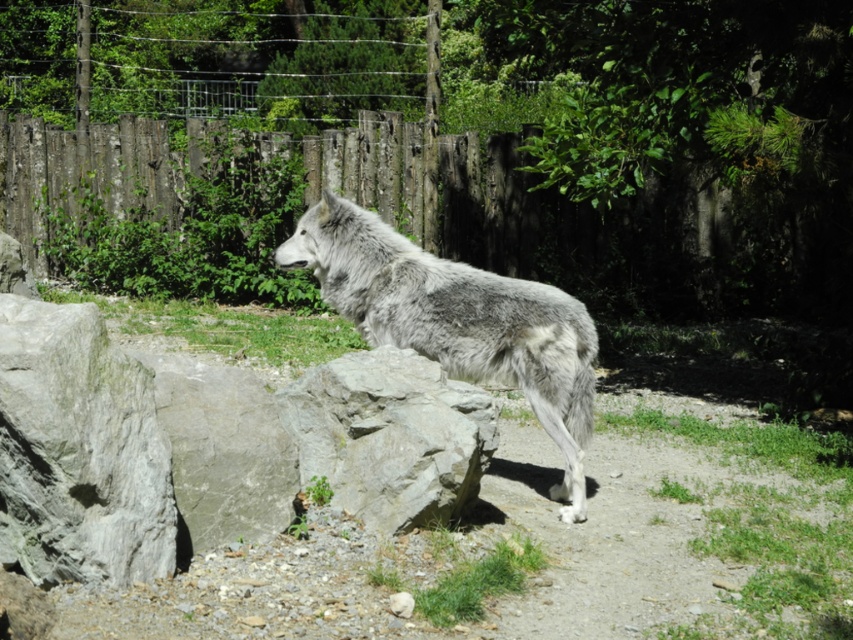
You are a zookeeper trying to place a new feeding station in the enclosure. The feeding station must be placed exactly at the point with coordinates point (79,451). What object is located at that point?

The point (79,451) corresponds to the gray rough rock at lower left.

You are standing at the point marked as point (132, 488) in the zoo enclosure. You want to toss a small treat to the wolf, but you must ensure that the distance between you and the wolf is at least 3 meters for safety. Can you safely toss the treat from your current position?

The distance between you and the wolf is 5.55 meters, which is more than the required 3 meters. Therefore, you can safely toss the treat from your current position.

You are a zookeeper who needs to ensure the gray fur wolf at center and the gray rough rock at center are visible to visitors. Since the rock is part of the enclosure design, can you confirm if the wolf is tall enough to be seen over the rock?

The gray fur wolf at center is taller than the gray rough rock at center, so yes, the wolf can be seen over the rock from the visitors viewing angle.